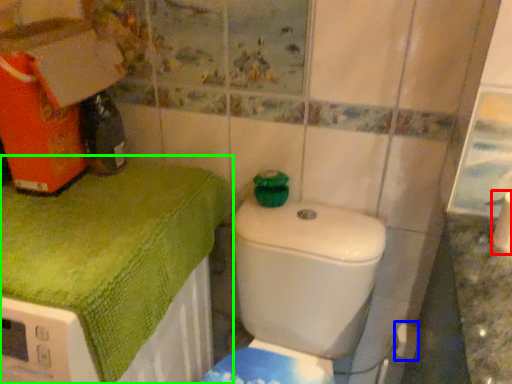
Question: Which object is positioned closest to toilet paper (highlighted by a red box)? Select from toilet paper (highlighted by a blue box) and bath towel (highlighted by a green box).

Choices:
 (A) toilet paper
 (B) bath towel

Answer: (A)